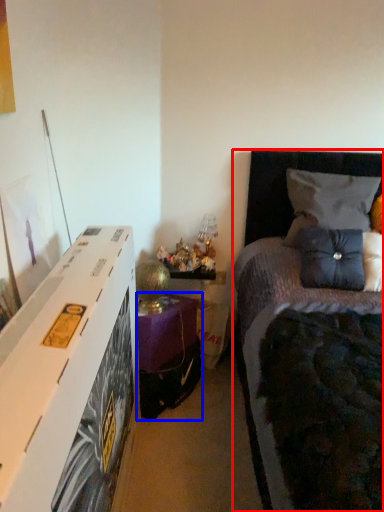
Question: Which object is further to the camera taking this photo, bed (highlighted by a red box) or nightstand (highlighted by a blue box)?

Choices:
 (A) bed
 (B) nightstand

Answer: (B)